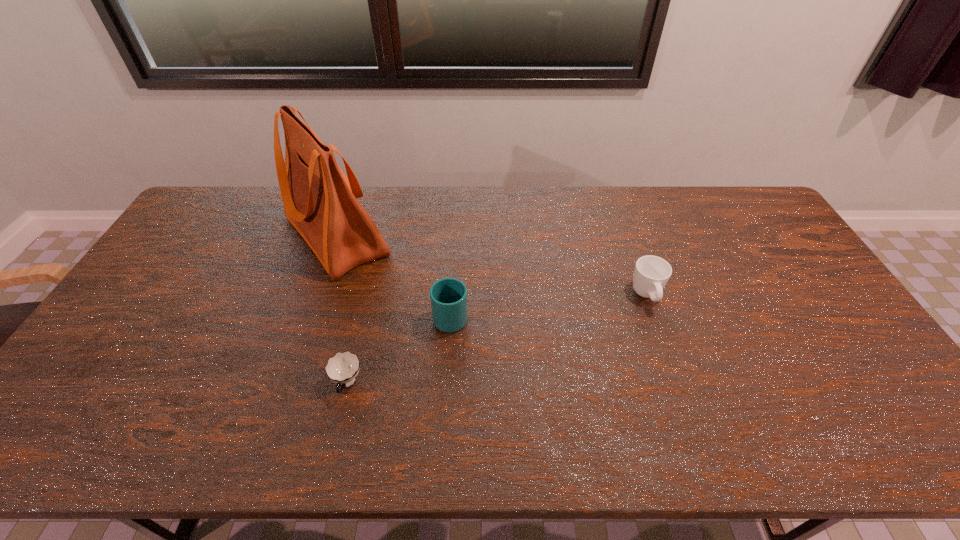
In order to click on vacant position located 0.090m on the handle side of the second object from right to left in this screenshot , I will do `click(453, 276)`.

At what (x,y) coordinates should I click in order to perform the action: click on free space located 0.370m with the handle on the side of the rightmost object. Please return your answer as a coordinate pair (x, y). Image resolution: width=960 pixels, height=540 pixels. Looking at the image, I should click on (698, 442).

What are the coordinates of `free region located 0.110m on the side of the nearest object with the handle` in the screenshot? It's located at (332, 448).

Locate an element on the screen. This screenshot has width=960, height=540. object situated at the far edge is located at coordinates (319, 200).

In the image, there is a desktop. Where is `vacant area at the far edge`? This screenshot has width=960, height=540. vacant area at the far edge is located at coordinates (531, 222).

In order to click on free space at the left edge of the desktop in this screenshot , I will do `click(158, 329)`.

At what (x,y) coordinates should I click in order to perform the action: click on vacant space at the right edge of the desktop. Please return your answer as a coordinate pair (x, y). This screenshot has height=540, width=960. Looking at the image, I should click on (766, 268).

Find the location of a particular element. The height and width of the screenshot is (540, 960). free region at the far right corner of the desktop is located at coordinates (747, 218).

Where is `vacant space that's between the shortest object and the rightmost cup`? vacant space that's between the shortest object and the rightmost cup is located at coordinates (497, 340).

Identify the location of free space that is in between the leftmost cup and the third tallest object. The image size is (960, 540). [x=497, y=340].